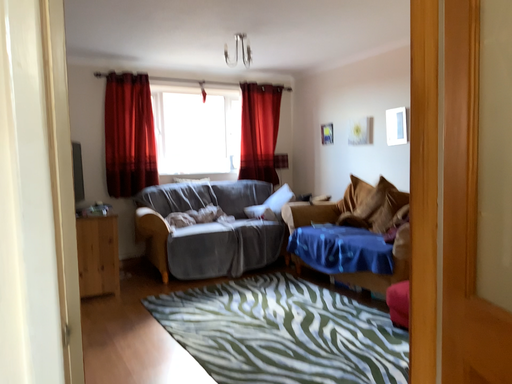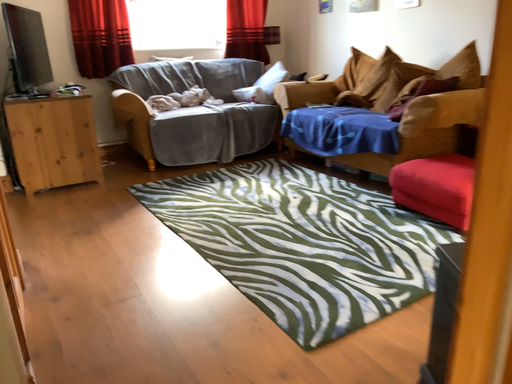
Question: How did the camera likely rotate when shooting the video?

Choices:
 (A) rotated upward
 (B) rotated downward

Answer: (B)